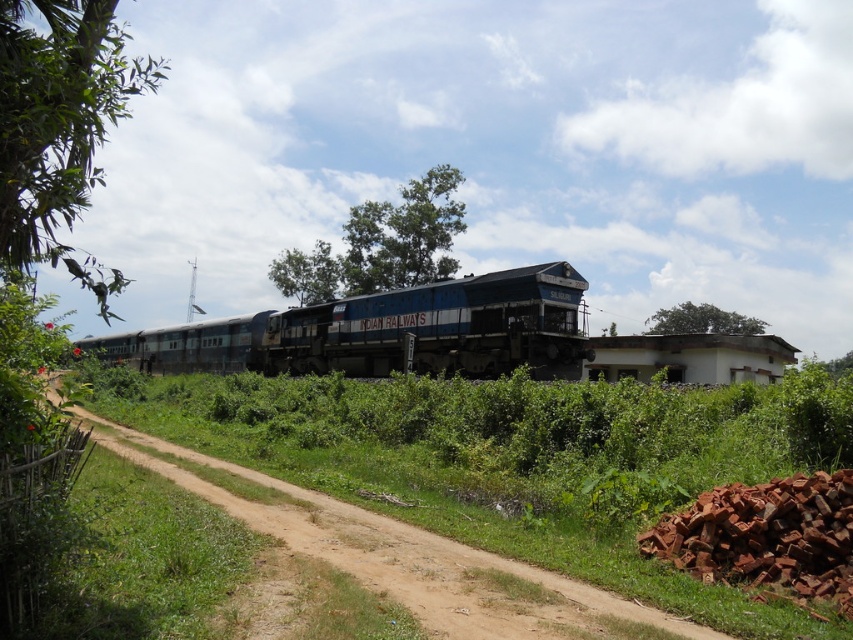
You are standing at the edge of the dirt path in the rural railway scene. You want to take a photo of the green leafy tree at upper left without moving closer than 4 meters from your current position. Is this possible?

The green leafy tree at upper left is 4.54 meters away from the viewer. Since you need to stay at least 4 meters away, you can take the photo without moving closer because 4.54 meters is more than 4 meters.

You are a photographer standing at the edge of the dirt path. You want to take a photo of the blue painted steel train at center and the brown dirt track at center. According to the scene description, which object is positioned to the left of the other?

The blue painted steel train at center is to the left of brown dirt track at center.